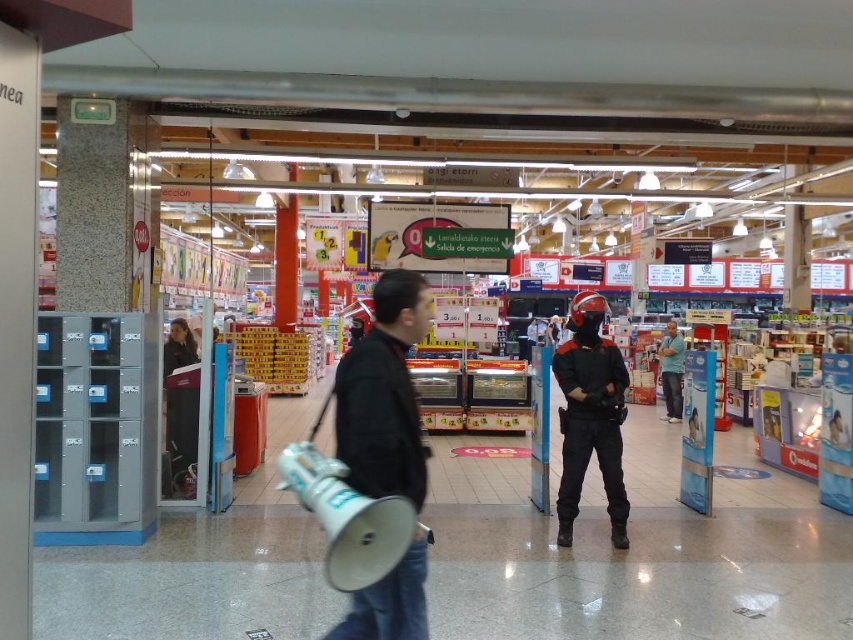
Question: Does black matte uniform at center have a smaller size compared to blue fabric shirt at center?

Choices:
 (A) no
 (B) yes

Answer: (B)

Question: Is black matte megaphone at center closer to camera compared to black matte uniform at center?

Choices:
 (A) no
 (B) yes

Answer: (B)

Question: Which of the following is the closest to the observer?

Choices:
 (A) black matte megaphone at center
 (B) black matte uniform at center

Answer: (A)

Question: Does black matte uniform at center have a larger size compared to blue fabric shirt at center?

Choices:
 (A) no
 (B) yes

Answer: (A)

Question: Which point is closer to the camera taking this photo?

Choices:
 (A) (669, 417)
 (B) (421, 314)
 (C) (584, 308)

Answer: (B)

Question: Which point appears farthest from the camera in this image?

Choices:
 (A) pyautogui.click(x=572, y=538)
 (B) pyautogui.click(x=669, y=364)
 (C) pyautogui.click(x=372, y=301)

Answer: (B)